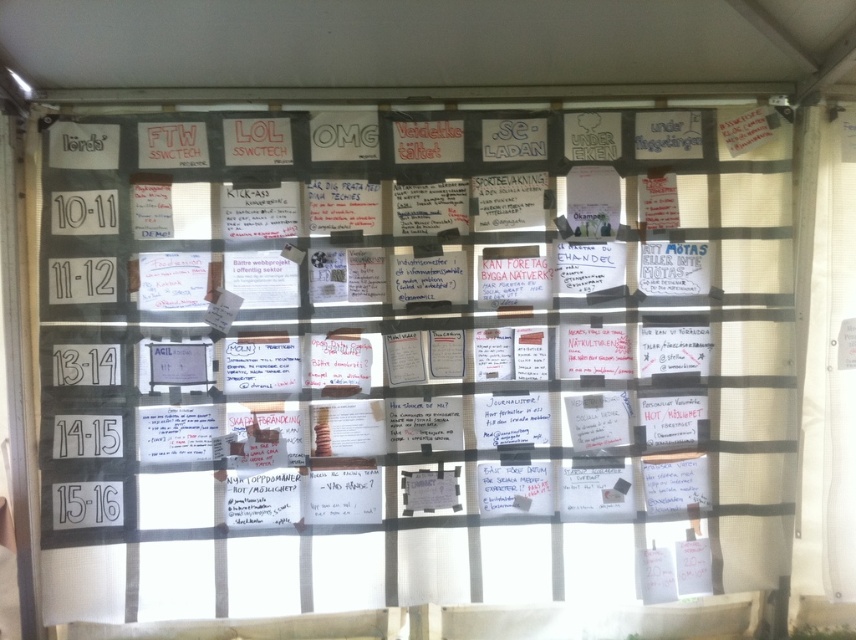
This screenshot has width=856, height=640. What do you see at coordinates (411, 360) in the screenshot?
I see `white paper notes at center` at bounding box center [411, 360].

What are the coordinates of `white paper notes at center` in the screenshot? It's located at (411, 360).

The height and width of the screenshot is (640, 856). Describe the element at coordinates (411, 360) in the screenshot. I see `white paper notes at center` at that location.

The width and height of the screenshot is (856, 640). I want to click on white paper notes at center, so click(x=411, y=360).